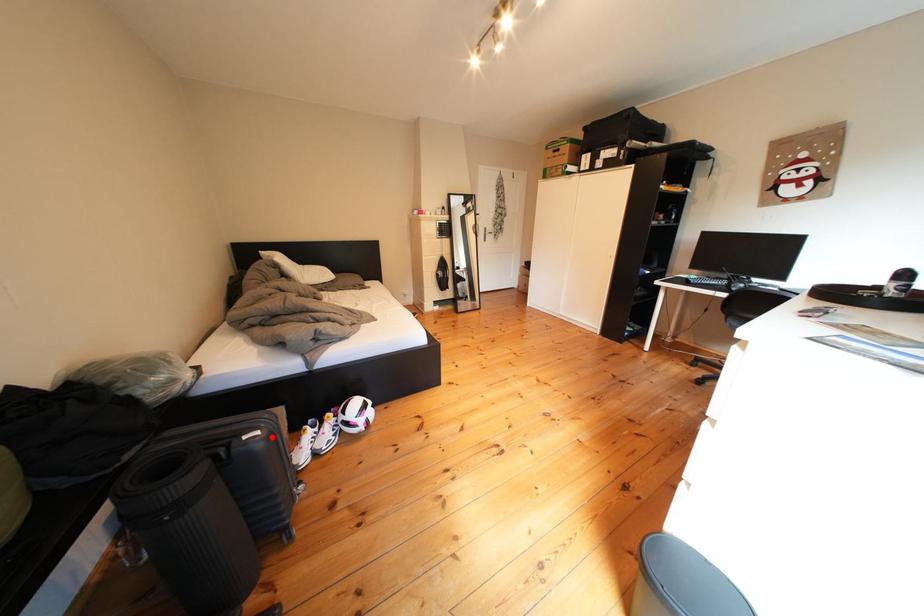
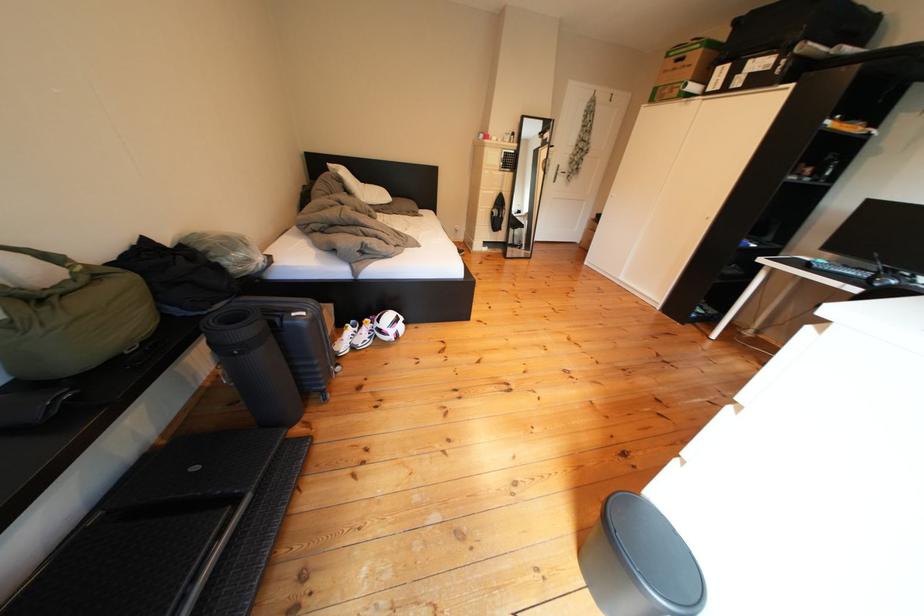
Find the pixel in the second image that matches the highlighted location in the first image.

(317, 318)